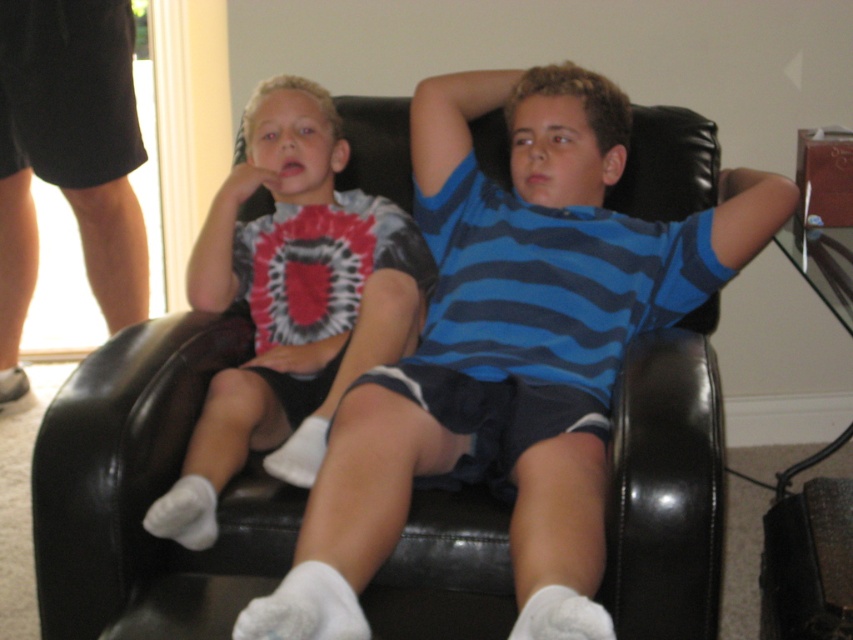
Question: Is the position of blue striped shirt at center less distant than that of tie-dye t-shirt at left?

Choices:
 (A) no
 (B) yes

Answer: (B)

Question: Which point is farther to the camera?

Choices:
 (A) (467, 262)
 (B) (347, 220)

Answer: (B)

Question: Is blue striped shirt at center to the right of tie-dye t-shirt at left from the viewer's perspective?

Choices:
 (A) no
 (B) yes

Answer: (B)

Question: Which of the following is the farthest from the observer?

Choices:
 (A) tie-dye t-shirt at left
 (B) blue striped shirt at center

Answer: (A)

Question: Is blue striped shirt at center thinner than tie-dye t-shirt at left?

Choices:
 (A) no
 (B) yes

Answer: (A)